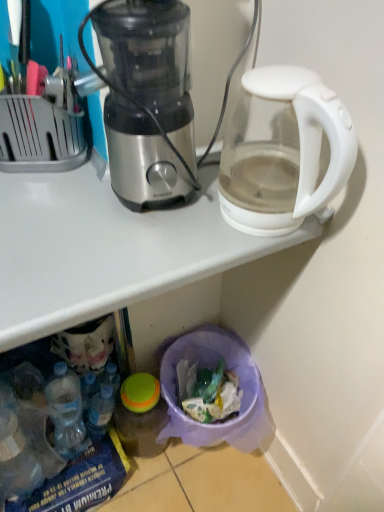
Where is `free space between stainless steel blender at center and transparent glass kettle at upper right`? free space between stainless steel blender at center and transparent glass kettle at upper right is located at coordinates tap(190, 229).